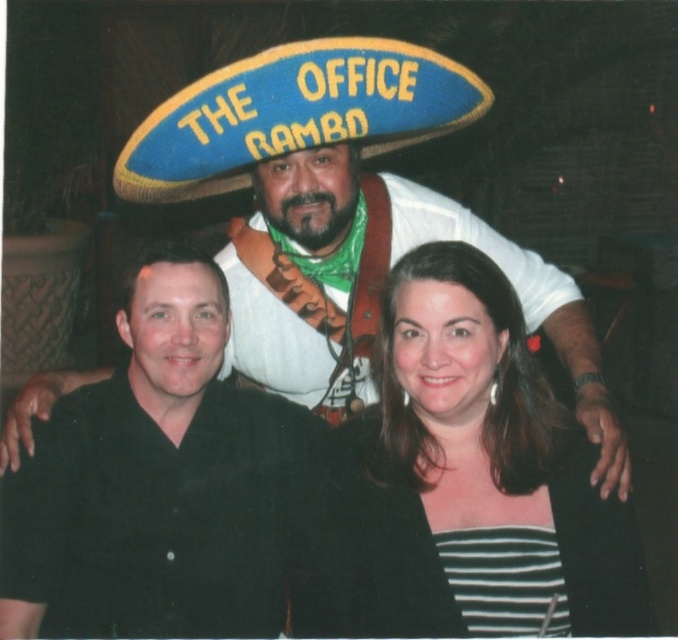
You are a photographer setting up for a group photo. You have a camera with a lens that has a minimum focusing distance of 18 inches. You want to ensure that both the black matte shirt at left and the blue felt sombrero at upper center are in focus. Can you position yourself so that both are within the camera lens focusing range?

The distance between the black matte shirt at left and the blue felt sombrero at upper center is 18.39 inches. Since the minimum focusing distance is 18 inches, the photographer can position themselves within 18 inches of the closest subject, ensuring both are within the focusing range as the total distance between them is just over the minimum requirement.